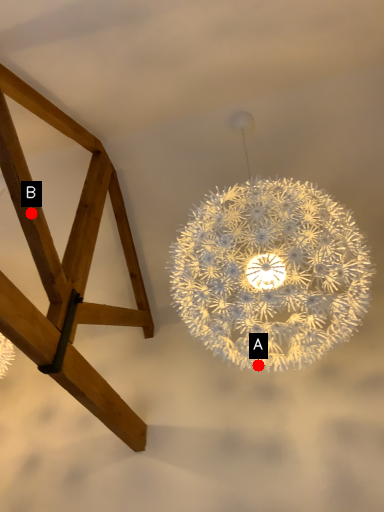
Question: Two points are circled on the image, labeled by A and B beside each circle. Which point is farther to the camera?

Choices:
 (A) A is further
 (B) B is further

Answer: (B)